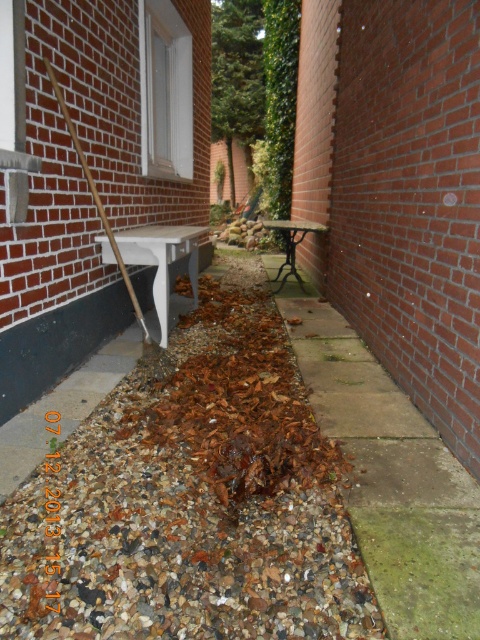
Who is more distant from viewer, (157, 266) or (319, 228)?

The point (319, 228) is behind.

Is point (100, 244) closer to camera compared to point (294, 250)?

Yes, point (100, 244) is in front of point (294, 250).

The image size is (480, 640). I want to click on white glossy bench at left, so click(x=162, y=259).

You are a GUI agent. You are given a task and a screenshot of the screen. Output one action in this format:
    pyautogui.click(x=<x>, y=<y>)
    Task: Click on the white glossy bench at left
    This screenshot has width=480, height=640.
    Given the screenshot: What is the action you would take?
    pyautogui.click(x=162, y=259)

Can you confirm if brown leaf litter at center is thinner than white glossy bench at left?

No, brown leaf litter at center is not thinner than white glossy bench at left.

What do you see at coordinates (192, 500) in the screenshot? I see `brown leaf litter at center` at bounding box center [192, 500].

Where is `brown leaf litter at center`? The image size is (480, 640). brown leaf litter at center is located at coordinates (192, 500).

Is brown leaf litter at center thinner than wooden bench at center?

Incorrect, brown leaf litter at center's width is not less than wooden bench at center's.

Is brown leaf litter at center positioned before wooden bench at center?

Yes.

Describe the element at coordinates (192, 500) in the screenshot. I see `brown leaf litter at center` at that location.

The width and height of the screenshot is (480, 640). I want to click on brown leaf litter at center, so click(192, 500).